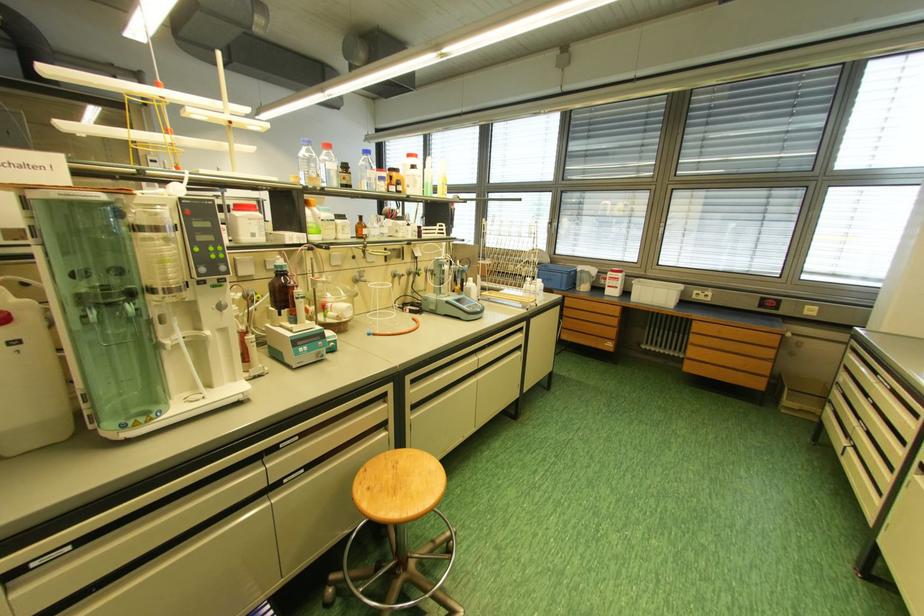
Find where to push the green machine button. Please return your answer as a coordinate pair (x, y).

(203, 248)